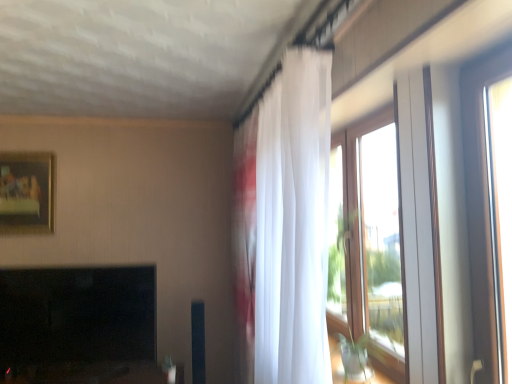
In order to face clear glass window at right, should I rotate leftwards or rightwards?

Result: You should look right and rotate roughly 29.320 degrees.

This screenshot has width=512, height=384. In order to click on white sheer curtain at upper right in this screenshot , I will do `click(293, 222)`.

Locate an element on the screen. The width and height of the screenshot is (512, 384). clear glass window at right is located at coordinates (489, 208).

From a real-world perspective, is matte gold picture frame at upper left located higher than white sheer curtain at upper right?

Correct, in the physical world, matte gold picture frame at upper left is higher than white sheer curtain at upper right.

Considering the relative positions of matte gold picture frame at upper left and white sheer curtain at upper right in the image provided, is matte gold picture frame at upper left to the right of white sheer curtain at upper right from the viewer's perspective?

No.

Is matte gold picture frame at upper left closer to the viewer compared to white sheer curtain at upper right?

No, matte gold picture frame at upper left is behind white sheer curtain at upper right.

Which is farther from the camera, (12, 213) or (257, 252)?

The point (12, 213) is farther from the camera.

Does matte gold picture frame at upper left have a lesser height compared to black glossy fireplace at lower left?

Indeed, matte gold picture frame at upper left has a lesser height compared to black glossy fireplace at lower left.

You are a GUI agent. You are given a task and a screenshot of the screen. Output one action in this format:
    pyautogui.click(x=<x>, y=<y>)
    Task: Click on the picture frame behind the black glossy fireplace at lower left
    Image resolution: width=512 pixels, height=384 pixels.
    Given the screenshot: What is the action you would take?
    pyautogui.click(x=27, y=192)

Are matte gold picture frame at upper left and black glossy fireplace at lower left beside each other?

They are not placed beside each other.

In the scene shown: Which object is positioned more to the left, white sheer curtain at upper right or clear glass window at right?

white sheer curtain at upper right.

From the image's perspective, would you say white sheer curtain at upper right is shown under clear glass window at right?

Correct, white sheer curtain at upper right appears lower than clear glass window at right in the image.

Can you confirm if white sheer curtain at upper right is bigger than clear glass window at right?

Yes.

Does white sheer curtain at upper right have a greater width compared to clear glass window at right?

Correct, the width of white sheer curtain at upper right exceeds that of clear glass window at right.

Are black glossy fireplace at lower left and matte gold picture frame at upper left located far from each other?

black glossy fireplace at lower left is near matte gold picture frame at upper left, not far away.

From a real-world perspective, is black glossy fireplace at lower left positioned above or below matte gold picture frame at upper left?

Clearly, from a real-world perspective, black glossy fireplace at lower left is below matte gold picture frame at upper left.

Can you confirm if black glossy fireplace at lower left is taller than matte gold picture frame at upper left?

Yes, black glossy fireplace at lower left is taller than matte gold picture frame at upper left.

Which is correct: white sheer curtain at upper right is inside matte gold picture frame at upper left, or outside of it?

white sheer curtain at upper right exists outside the volume of matte gold picture frame at upper left.

From the image's perspective, is white sheer curtain at upper right on matte gold picture frame at upper left?

No, from the image's perspective, white sheer curtain at upper right is not over matte gold picture frame at upper left.

Is white sheer curtain at upper right positioned far away from matte gold picture frame at upper left?

Yes, white sheer curtain at upper right and matte gold picture frame at upper left are quite far apart.

Can you confirm if white sheer curtain at upper right is smaller than matte gold picture frame at upper left?

No, white sheer curtain at upper right is not smaller than matte gold picture frame at upper left.

Locate an element on the screen. window below the matte gold picture frame at upper left (from a real-world perspective) is located at coordinates (489, 208).

Is matte gold picture frame at upper left not close to clear glass window at right?

That's right, there is a large distance between matte gold picture frame at upper left and clear glass window at right.

From the image's perspective, which object appears higher, matte gold picture frame at upper left or clear glass window at right?

From the image's view, matte gold picture frame at upper left is above.

Identify the location of curtain on the left side of clear glass window at right. (293, 222).

Consider the image. Which is more to the left, clear glass window at right or white sheer curtain at upper right?

white sheer curtain at upper right is more to the left.

Which point is more forward, (503, 221) or (309, 68)?

The point (503, 221) is closer.

The height and width of the screenshot is (384, 512). I want to click on picture frame that appears on the left of white sheer curtain at upper right, so tap(27, 192).

Where is `picture frame above the black glossy fireplace at lower left (from a real-world perspective)`? This screenshot has height=384, width=512. picture frame above the black glossy fireplace at lower left (from a real-world perspective) is located at coordinates (27, 192).

When comparing their distances from matte gold picture frame at upper left, does white sheer curtain at upper right or black glossy fireplace at lower left seem further?

white sheer curtain at upper right is further to matte gold picture frame at upper left.

Looking at the image, which one is located further to matte gold picture frame at upper left, clear glass window at right or black glossy fireplace at lower left?

clear glass window at right.

When comparing their distances from black glossy fireplace at lower left, does clear glass window at right or matte gold picture frame at upper left seem closer?

matte gold picture frame at upper left.

Based on their spatial positions, is matte gold picture frame at upper left or white sheer curtain at upper right further from black glossy fireplace at lower left?

white sheer curtain at upper right.

Considering their positions, is white sheer curtain at upper right positioned closer to black glossy fireplace at lower left than matte gold picture frame at upper left?

Based on the image, matte gold picture frame at upper left appears to be nearer to black glossy fireplace at lower left.

Based on their spatial positions, is clear glass window at right or matte gold picture frame at upper left further from white sheer curtain at upper right?

Based on the image, matte gold picture frame at upper left appears to be further to white sheer curtain at upper right.

In the scene shown: Considering their positions, is matte gold picture frame at upper left positioned further to clear glass window at right than white sheer curtain at upper right?

matte gold picture frame at upper left is positioned further to the anchor clear glass window at right.

Looking at the image, which one is located further to clear glass window at right, white sheer curtain at upper right or matte gold picture frame at upper left?

matte gold picture frame at upper left is positioned further to the anchor clear glass window at right.

At what (x,y) coordinates should I click in order to perform the action: click on curtain situated between black glossy fireplace at lower left and clear glass window at right from left to right. Please return your answer as a coordinate pair (x, y). Looking at the image, I should click on (293, 222).

The width and height of the screenshot is (512, 384). Find the location of `fireplace located between matte gold picture frame at upper left and clear glass window at right in the left-right direction`. fireplace located between matte gold picture frame at upper left and clear glass window at right in the left-right direction is located at coordinates (79, 326).

Identify the location of fireplace between matte gold picture frame at upper left and white sheer curtain at upper right. The height and width of the screenshot is (384, 512). (79, 326).

Locate an element on the screen. Image resolution: width=512 pixels, height=384 pixels. curtain between matte gold picture frame at upper left and clear glass window at right in the horizontal direction is located at coordinates (293, 222).